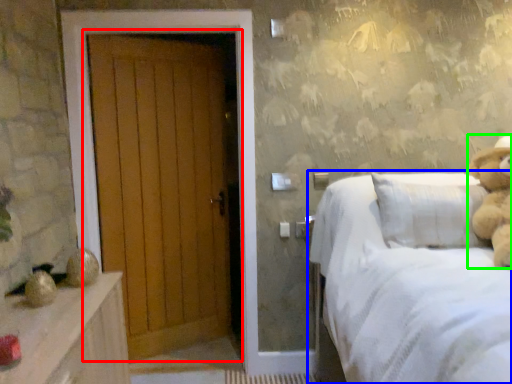
Question: Which is farther away from door (highlighted by a red box)? bed (highlighted by a blue box) or teddy bear (highlighted by a green box)?

Choices:
 (A) bed
 (B) teddy bear

Answer: (B)